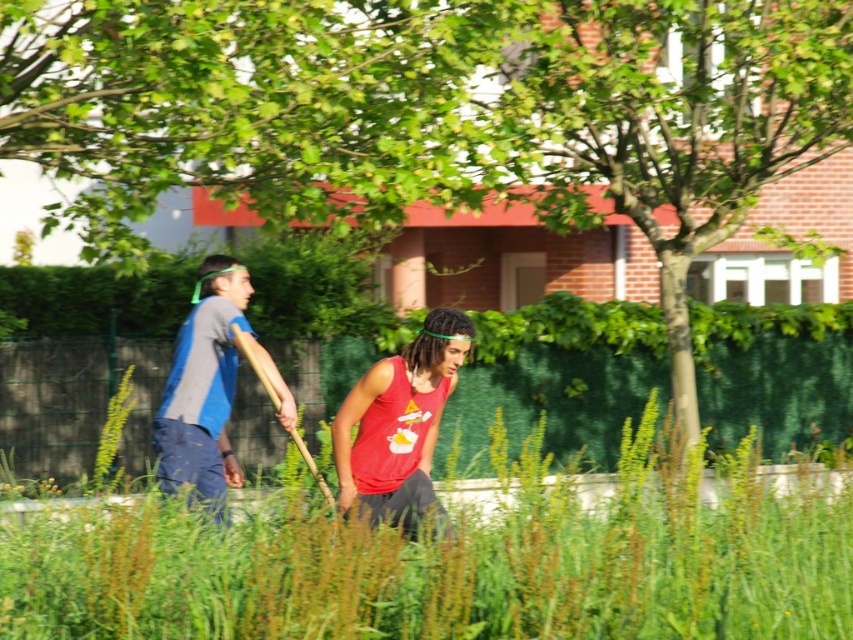
You are standing at the point marked by the coordinates point (451, 566) in the image. What is the primary color of the ground beneath your feet?

The point (451, 566) indicates green grass at center, so the primary color of the ground beneath your feet is green.

You are standing at point (451, 566) in the garden. What is the terrain like at your current location?

The terrain at point (451, 566) is green grass at center.